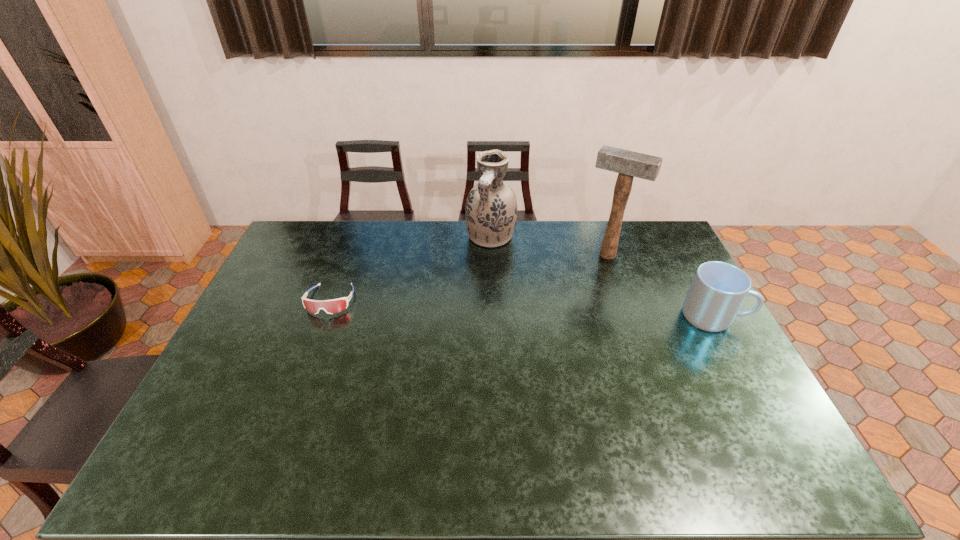
Locate an element on the screen. free space on the desktop that is between the shortest object and the rightmost object and is positioned on the striking surface of the third object from left to right is located at coordinates (575, 310).

You are a GUI agent. You are given a task and a screenshot of the screen. Output one action in this format:
    pyautogui.click(x=<x>, y=<y>)
    Task: Click on the free spot on the desktop that is between the shortest object and the mug and is positioned with the handle on the side of the third object from right to left
    
    Given the screenshot: What is the action you would take?
    pyautogui.click(x=465, y=306)